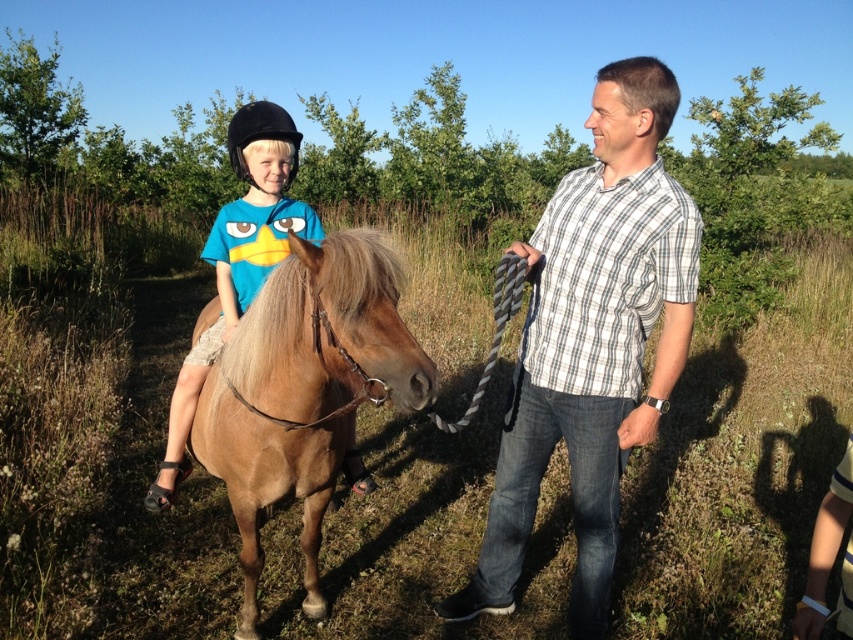
You are standing at the origin of a coordinate system placed at the bottom left corner of the image. The point at coordinates point (305, 390) is marked. What object is located at this point?

The point (305, 390) corresponds to the light brown glossy horse at center.

You are a photographer trying to capture the scene where the white checkered shirt at center and the light brown glossy horse at center are both visible. Based on their positions, which direction should you position yourself relative to the horse to ensure both are in frame?

Since the white checkered shirt at center is to the right of the light brown glossy horse at center, you should position yourself to the left of the horse to include both the white checkered shirt at center and the light brown glossy horse at center in the frame.

You are a photographer planning to take a photo of the light brown glossy horse at center and the matte black helmet at upper left. Which object should you focus on first if you want to capture both in the same frame without moving the camera?

The light brown glossy horse at center is smaller in size compared to the matte black helmet at upper left, so you should focus on the larger matte black helmet at upper left first to ensure it is in clear view before adjusting for the smaller horse.